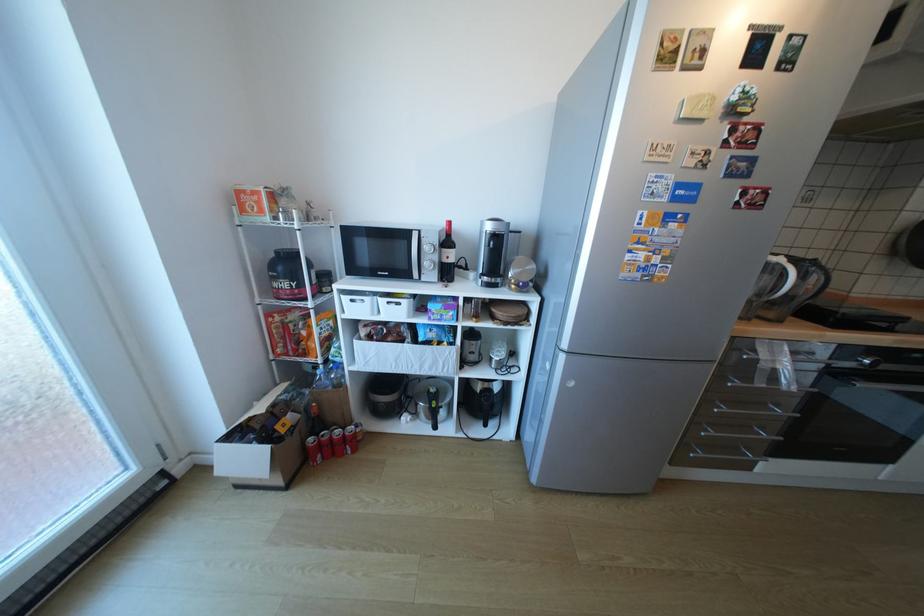
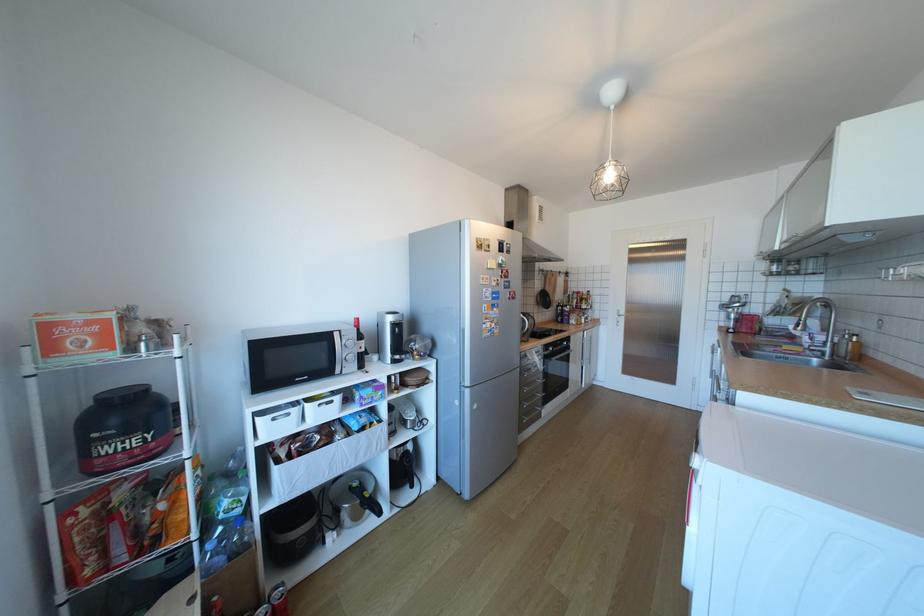
In the second image, find the point that corresponds to [415,235] in the first image.

(334, 338)